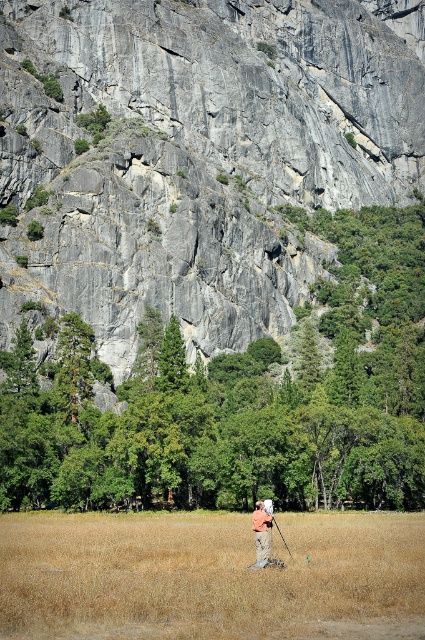
Is the position of gray rock at upper center more distant than that of brown dry grass at center?

That is True.

Is gray rock at upper center positioned before brown dry grass at center?

No, it is behind brown dry grass at center.

Locate an element on the screen. This screenshot has height=640, width=425. gray rock at upper center is located at coordinates (197, 154).

Find the location of a particular element. gray rock at upper center is located at coordinates (197, 154).

Is green leafy tree at upper center thinner than black matte tripod at center?

Incorrect, green leafy tree at upper center's width is not less than black matte tripod at center's.

The height and width of the screenshot is (640, 425). What do you see at coordinates (238, 400) in the screenshot?
I see `green leafy tree at upper center` at bounding box center [238, 400].

This screenshot has width=425, height=640. I want to click on green leafy tree at upper center, so click(238, 400).

Can you confirm if brown dry grass at center is positioned below camouflage pants at center?

Yes.

Does point (65, 616) lie behind point (269, 522)?

No, (65, 616) is closer to viewer.

Between point (3, 541) and point (266, 524), which one is positioned behind?

The point (3, 541) is more distant.

Image resolution: width=425 pixels, height=640 pixels. In order to click on brown dry grass at center in this screenshot , I will do `click(209, 577)`.